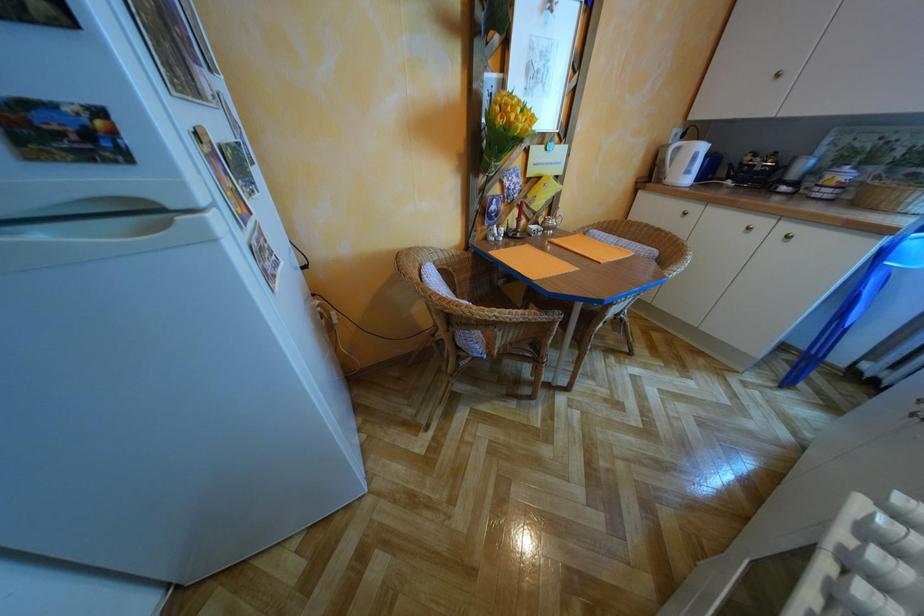
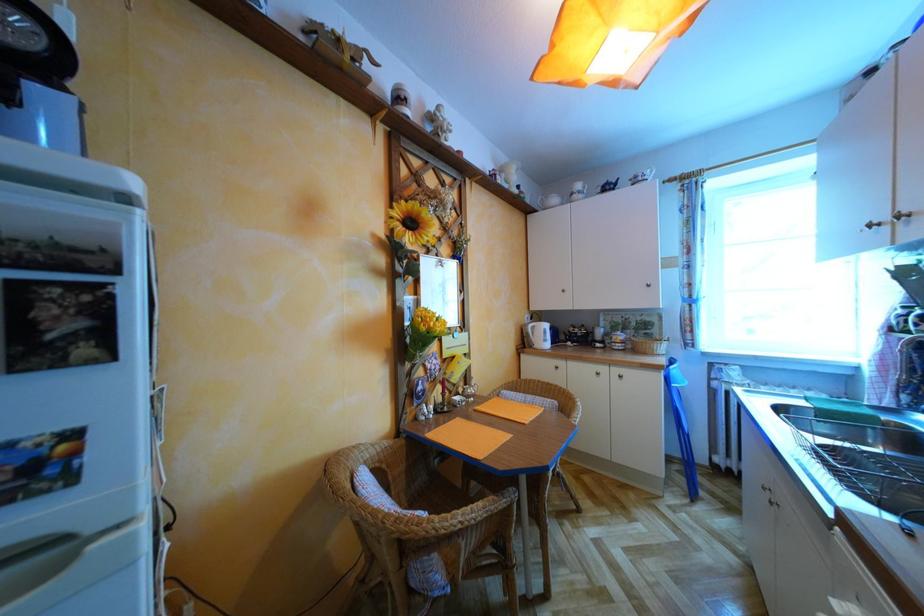
Based on the continuous images, in which direction is the camera rotating?

The camera rotated toward right-up.